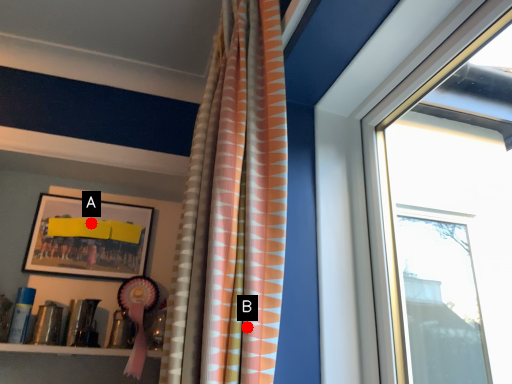
Question: Two points are circled on the image, labeled by A and B beside each circle. Which point appears closest to the camera in this image?

Choices:
 (A) A is closer
 (B) B is closer

Answer: (B)